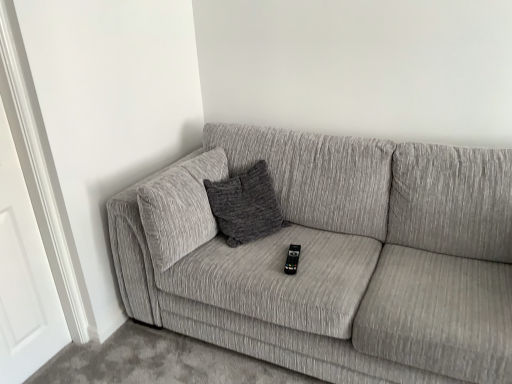
Question: Should I look upward or downward to see white wood door at left?

Choices:
 (A) up
 (B) down

Answer: (B)

Question: Is black plastic remote at center to the right of white wood door at left from the viewer's perspective?

Choices:
 (A) no
 (B) yes

Answer: (B)

Question: Is black plastic remote at center not within white wood door at left?

Choices:
 (A) yes
 (B) no

Answer: (A)

Question: Can you confirm if black plastic remote at center is positioned to the left of white wood door at left?

Choices:
 (A) no
 (B) yes

Answer: (A)

Question: Can you confirm if black plastic remote at center is smaller than white wood door at left?

Choices:
 (A) yes
 (B) no

Answer: (A)

Question: From a real-world perspective, is black plastic remote at center positioned over white wood door at left based on gravity?

Choices:
 (A) yes
 (B) no

Answer: (B)

Question: Does black plastic remote at center have a greater width compared to white wood door at left?

Choices:
 (A) no
 (B) yes

Answer: (B)

Question: Could you tell me if white wood door at left is turned towards black plastic remote at center?

Choices:
 (A) yes
 (B) no

Answer: (B)

Question: Is white wood door at left oriented away from black plastic remote at center?

Choices:
 (A) no
 (B) yes

Answer: (A)

Question: Is the surface of white wood door at left in direct contact with black plastic remote at center?

Choices:
 (A) yes
 (B) no

Answer: (B)

Question: Is there a large distance between white wood door at left and black plastic remote at center?

Choices:
 (A) yes
 (B) no

Answer: (A)

Question: Is white wood door at left wider than black plastic remote at center?

Choices:
 (A) yes
 (B) no

Answer: (B)

Question: Is white wood door at left outside of black plastic remote at center?

Choices:
 (A) no
 (B) yes

Answer: (B)

Question: From a real-world perspective, is textured gray couch at center positioned over white wood door at left based on gravity?

Choices:
 (A) no
 (B) yes

Answer: (A)